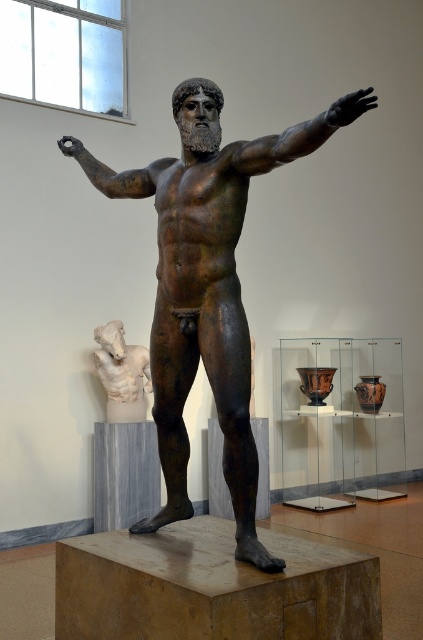
Is bronze statue at center below bronze muscular arm at upper center?

Indeed, bronze statue at center is positioned under bronze muscular arm at upper center.

Is bronze statue at center behind bronze muscular arm at upper center?

Yes.

Describe the element at coordinates (214, 292) in the screenshot. I see `bronze statue at center` at that location.

At what (x,y) coordinates should I click in order to perform the action: click on bronze statue at center. Please return your answer as a coordinate pair (x, y). Looking at the image, I should click on (214, 292).

Who is shorter, bronze muscular arm at upper center or white marble head at left?

bronze muscular arm at upper center

Is bronze muscular arm at upper center positioned at the back of white marble head at left?

No, it is in front of white marble head at left.

Locate an element on the screen. bronze muscular arm at upper center is located at coordinates (299, 134).

Who is more distant from viewer, (208,100) or (109,349)?

The point (109,349) is behind.

Can you confirm if bronze statue at center is positioned to the left of white marble head at left?

No, bronze statue at center is not to the left of white marble head at left.

Is point (198, 266) positioned after point (109, 344)?

That is False.

Where is `bronze statue at center`? bronze statue at center is located at coordinates (214, 292).